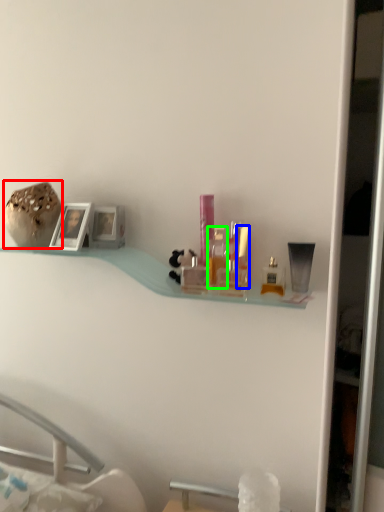
Question: Based on their relative distances, which object is farther from product (highlighted by a red box)? Choose from toiletry (highlighted by a blue box) and toiletry (highlighted by a green box).

Choices:
 (A) toiletry
 (B) toiletry

Answer: (A)